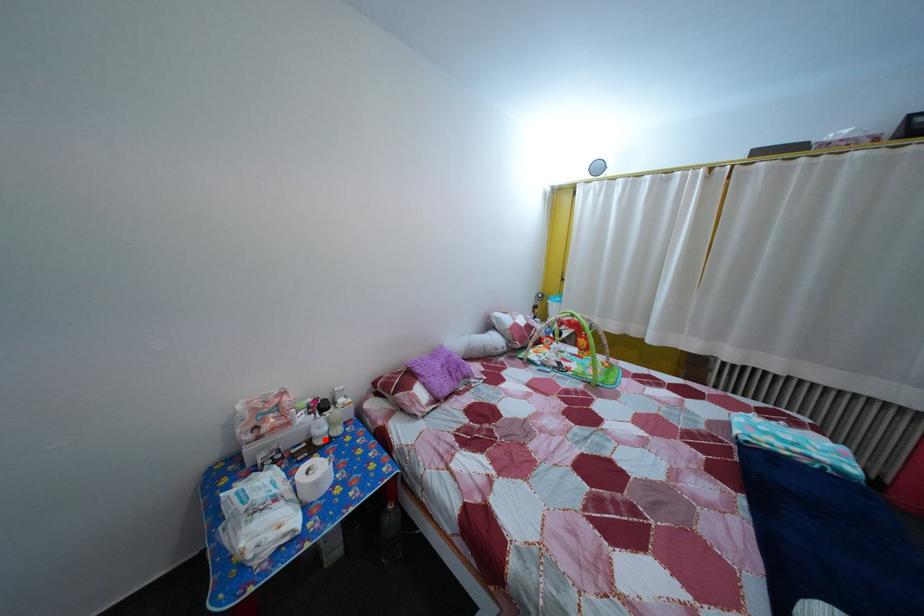
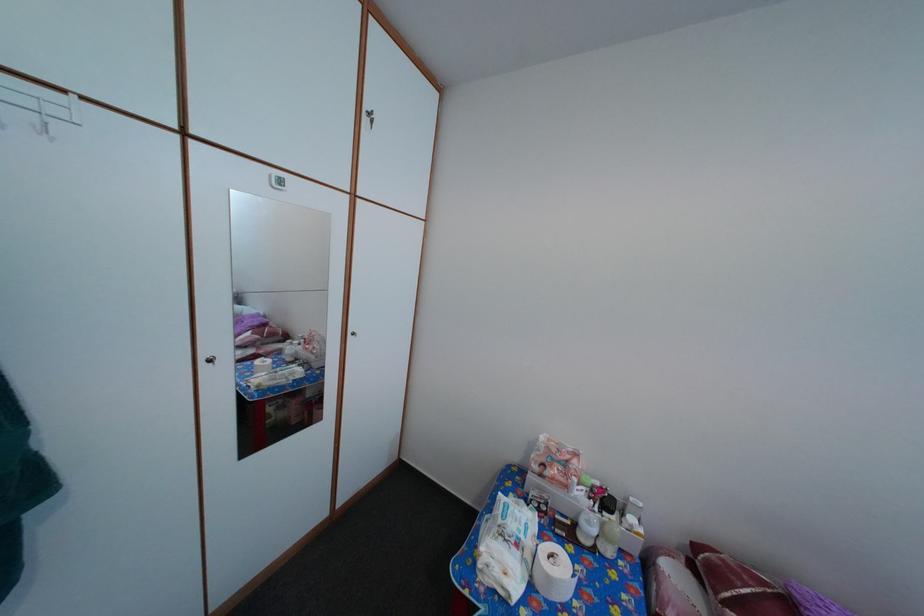
The point at the highlighted location is marked in the first image. Where is the corresponding point in the second image?

(592, 531)